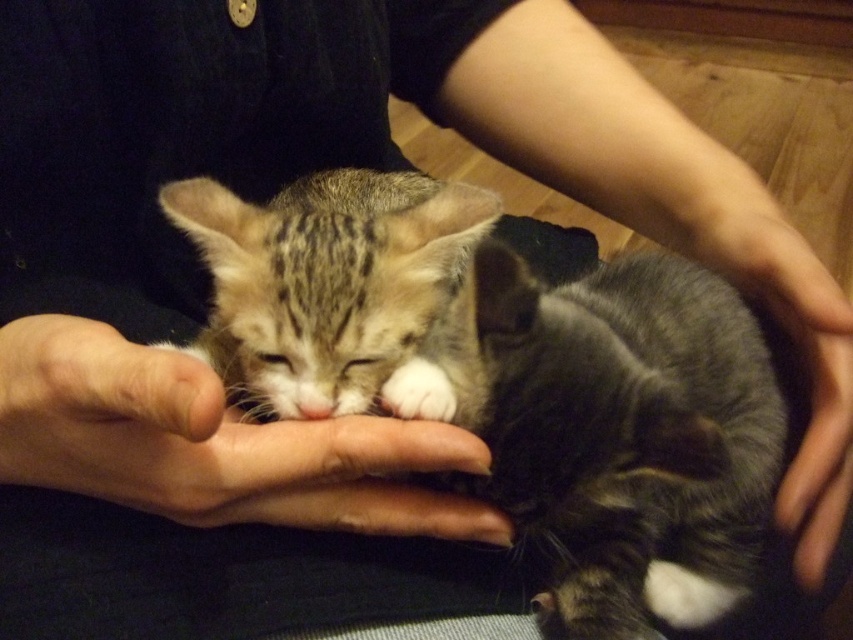
You are standing in the room and see two points marked in the image. The first point is at coordinates point (312, 513) and the second is at point (397, 317). Which point is closer to you?

Point (312, 513) is in front of point (397, 317), so it is closer to you.

Based on the photo, where is the smooth skin hand at center located in the image?

The smooth skin hand at center is located at the 2D coordinates point (212, 444).

You are a veterinarian examining the image of a person holding two kittens. You need to determine if the tabby fur kitten at center can fit entirely within the gray soft hand at lower right. Based on the spatial relationship shown, what is your assessment?

The tabby fur kitten at center might be wider than gray soft hand at lower right, so it may not fit entirely within the hand.